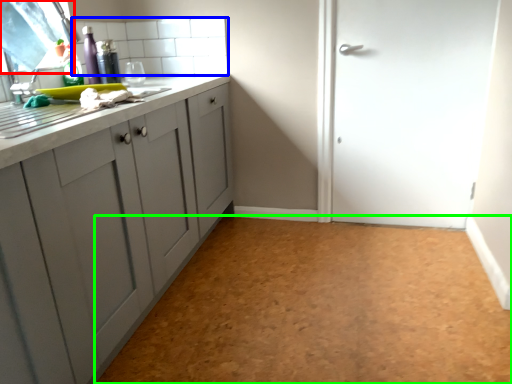
Question: Estimate the real-world distances between objects in this image. Which object is farther from window screen (highlighted by a red box), tile (highlighted by a blue box) or plain (highlighted by a green box)?

Choices:
 (A) tile
 (B) plain

Answer: (B)